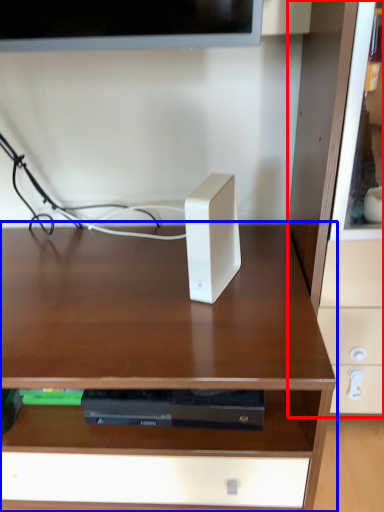
Question: Which object appears closest to the camera in this image, dresser (highlighted by a red box) or desk (highlighted by a blue box)?

Choices:
 (A) dresser
 (B) desk

Answer: (A)